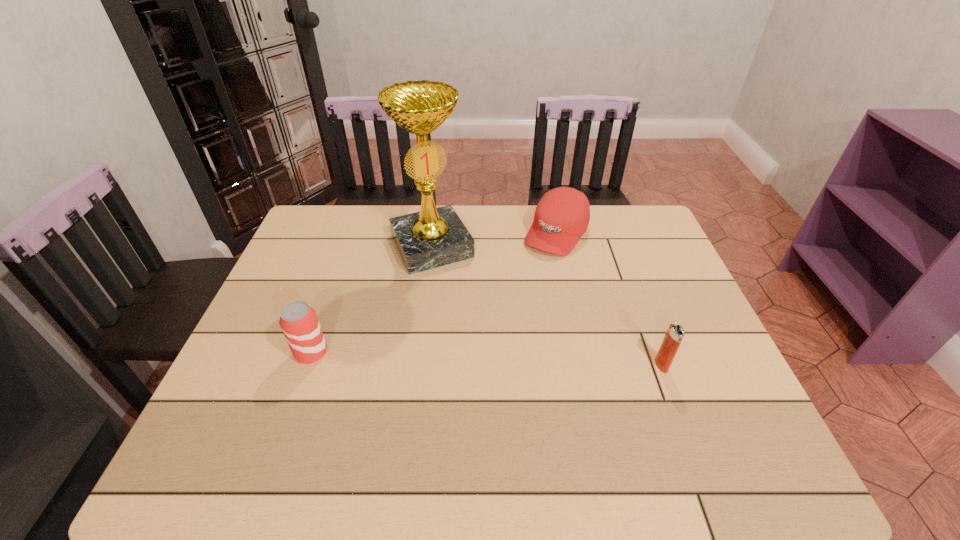
I want to click on vacant space located on the front-facing side of the cap, so [530, 275].

Locate an element on the screen. The image size is (960, 540). vacant space located 0.290m on the front-facing side of the cap is located at coordinates (499, 319).

Find the location of `vacant space located on the front-facing side of the cap`. vacant space located on the front-facing side of the cap is located at coordinates (493, 326).

Where is `award at the far edge`? award at the far edge is located at coordinates (434, 237).

Find the location of a particular element. cap that is at the far edge is located at coordinates (562, 215).

At what (x,y) coordinates should I click in order to perform the action: click on object that is at the left edge. Please return your answer as a coordinate pair (x, y). The width and height of the screenshot is (960, 540). Looking at the image, I should click on (298, 320).

The height and width of the screenshot is (540, 960). What are the coordinates of `object located in the right edge section of the desktop` in the screenshot? It's located at pos(674,335).

The width and height of the screenshot is (960, 540). In order to click on free space at the far edge of the desktop in this screenshot , I will do `click(484, 221)`.

In the image, there is a desktop. Identify the location of free space at the near edge. The image size is (960, 540). (405, 419).

The height and width of the screenshot is (540, 960). In order to click on vacant space at the left edge in this screenshot , I will do `click(279, 378)`.